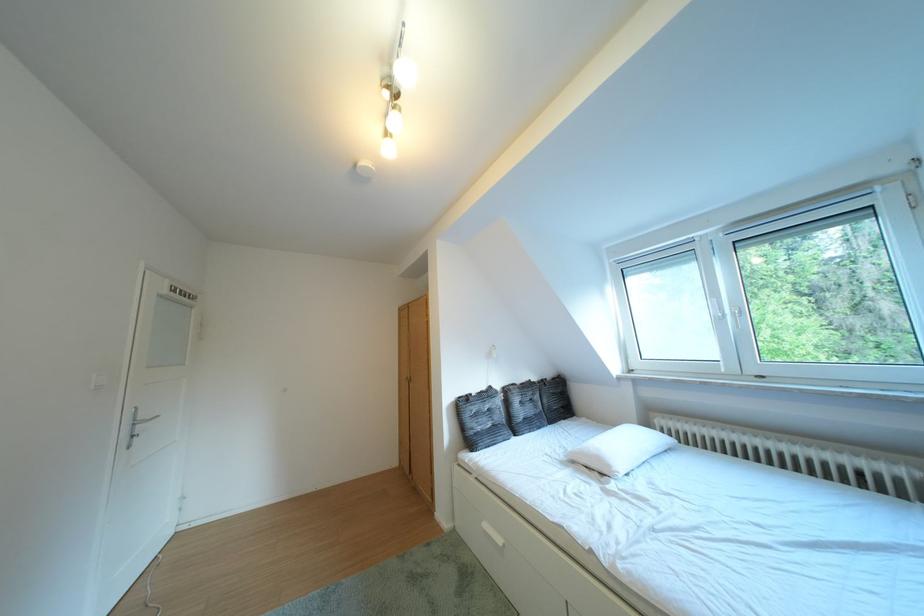
This screenshot has height=616, width=924. Describe the element at coordinates (139, 421) in the screenshot. I see `the silver door handle` at that location.